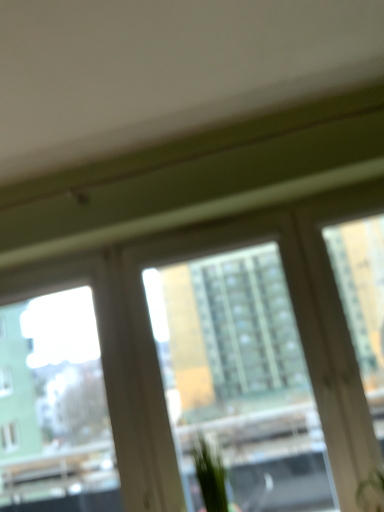
Question: Is transparent glass window at center smaller than green leafy plant at center, which is the 1th plant from left to right?

Choices:
 (A) no
 (B) yes

Answer: (A)

Question: From a real-world perspective, is transparent glass window at center under green leafy plant at center, the 2th plant when ordered from right to left?

Choices:
 (A) no
 (B) yes

Answer: (A)

Question: Is transparent glass window at center bigger than green leafy plant at center, which is the 1th plant from left to right?

Choices:
 (A) no
 (B) yes

Answer: (B)

Question: Is transparent glass window at center touching green leafy plant at center, which is the 1th plant from left to right?

Choices:
 (A) no
 (B) yes

Answer: (A)

Question: Is transparent glass window at center not inside green leafy plant at center, the 2th plant when ordered from right to left?

Choices:
 (A) no
 (B) yes

Answer: (B)

Question: Considering the positions of transparent glass window at center and green leafy plant at center, which is the 1th plant from left to right, in the image, is transparent glass window at center wider or thinner than green leafy plant at center, which is the 1th plant from left to right,?

Choices:
 (A) thin
 (B) wide

Answer: (B)

Question: Does point (327, 406) appear closer or farther from the camera than point (201, 461)?

Choices:
 (A) closer
 (B) farther

Answer: (B)

Question: Is transparent glass window at center in front of or behind green leafy plant at center, the 2th plant when ordered from right to left, in the image?

Choices:
 (A) behind
 (B) front

Answer: (B)

Question: From a real-world perspective, is transparent glass window at center physically located above or below green leafy plant at center, which is the 1th plant from left to right?

Choices:
 (A) below
 (B) above

Answer: (B)

Question: From a real-world perspective, relative to green matte plant at lower right, placed as the first plant when sorted from right to left, is transparent glass window at center vertically above or below?

Choices:
 (A) above
 (B) below

Answer: (A)

Question: Is transparent glass window at center situated inside green matte plant at lower right, arranged as the 2th plant when viewed from the left, or outside?

Choices:
 (A) inside
 (B) outside

Answer: (B)

Question: Considering their positions, is transparent glass window at center located in front of or behind green matte plant at lower right, placed as the first plant when sorted from right to left?

Choices:
 (A) front
 (B) behind

Answer: (B)

Question: From the image's perspective, is transparent glass window at center located above or below green matte plant at lower right, arranged as the 2th plant when viewed from the left?

Choices:
 (A) above
 (B) below

Answer: (A)

Question: Is green matte plant at lower right, placed as the first plant when sorted from right to left, wider or thinner than transparent glass window screen at left?

Choices:
 (A) wide
 (B) thin

Answer: (A)

Question: From the image's perspective, is green matte plant at lower right, arranged as the 2th plant when viewed from the left, above or below transparent glass window screen at left?

Choices:
 (A) below
 (B) above

Answer: (A)